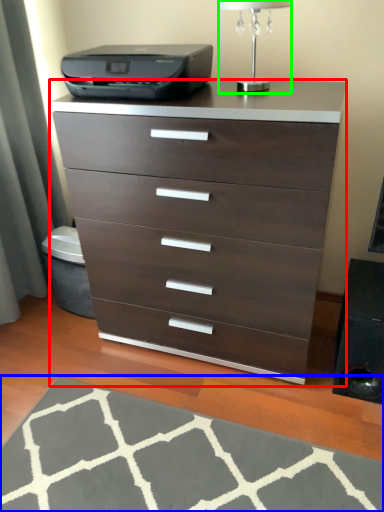
Question: Estimate the real-world distances between objects in this image. Which object is farther from chest of drawers (highlighted by a red box), doormat (highlighted by a blue box) or table lamp (highlighted by a green box)?

Choices:
 (A) doormat
 (B) table lamp

Answer: (B)